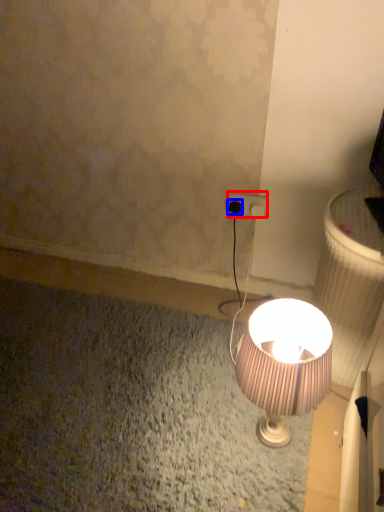
Question: Which of the following is the farthest to the observer, power plugs and sockets (highlighted by a red box) or plug (highlighted by a blue box)?

Choices:
 (A) power plugs and sockets
 (B) plug

Answer: (B)